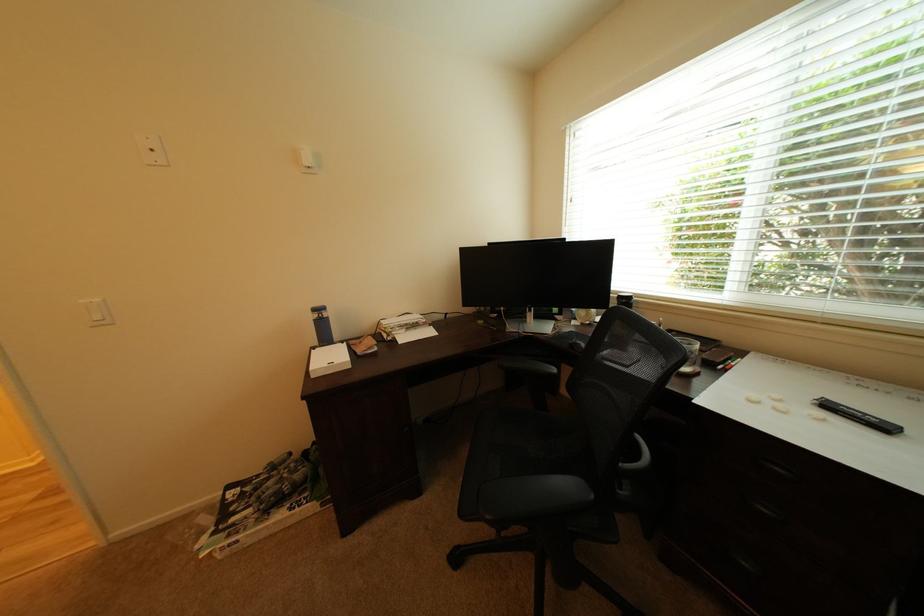
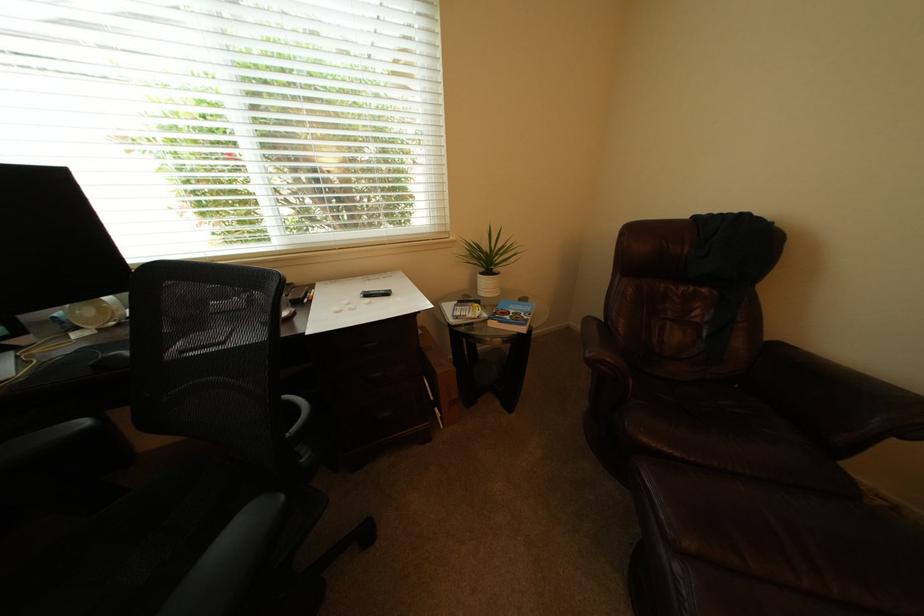
How did the camera likely rotate?

The rotation direction of the camera is right-down.